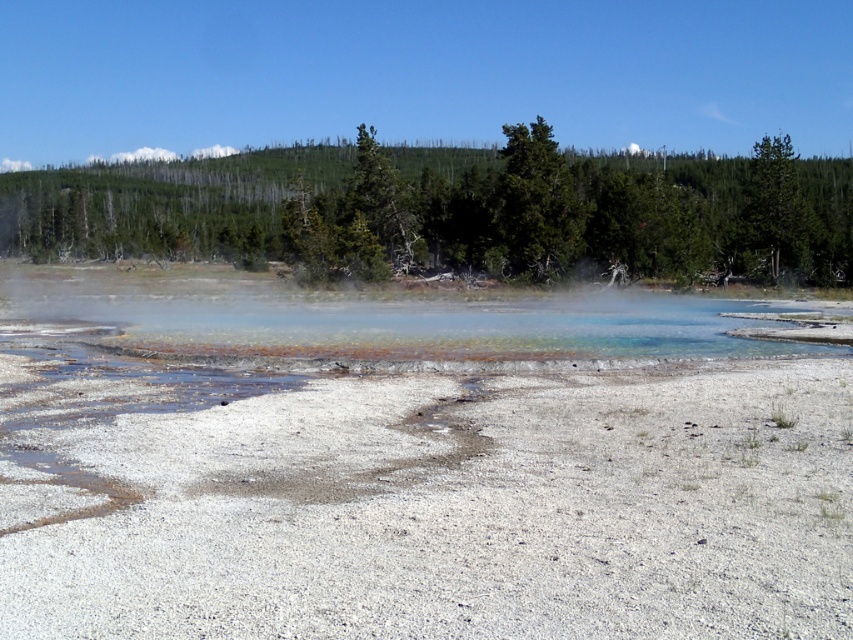
Is green leafy tree at upper center taller than translucent mineral water at center?

Yes, green leafy tree at upper center is taller than translucent mineral water at center.

Does green leafy tree at upper center appear on the right side of translucent mineral water at center?

Yes, green leafy tree at upper center is to the right of translucent mineral water at center.

Image resolution: width=853 pixels, height=640 pixels. I want to click on green leafy tree at upper center, so click(x=450, y=211).

Find the location of `green leafy tree at upper center`. green leafy tree at upper center is located at coordinates (450, 211).

Between green leafy tree at upper center and green matte tree at center, which one appears on the right side from the viewer's perspective?

green matte tree at center is more to the right.

Is green leafy tree at upper center wider than green matte tree at center?

Correct, the width of green leafy tree at upper center exceeds that of green matte tree at center.

This screenshot has width=853, height=640. What do you see at coordinates (450, 211) in the screenshot?
I see `green leafy tree at upper center` at bounding box center [450, 211].

Find the location of a particular element. green leafy tree at upper center is located at coordinates (450, 211).

Between green leafy tree at upper center and green matte tree at upper right, which one appears on the left side from the viewer's perspective?

green leafy tree at upper center

Who is lower down, green leafy tree at upper center or green matte tree at upper right?

green matte tree at upper right

Who is more distant from viewer, (473, 200) or (773, 221)?

Point (473, 200)

The height and width of the screenshot is (640, 853). I want to click on green leafy tree at upper center, so coord(450,211).